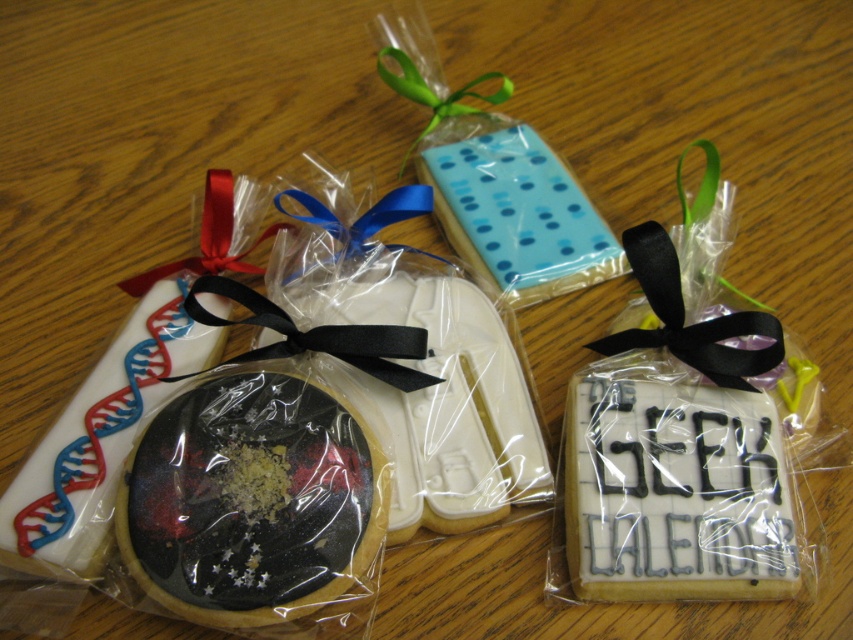
Question: Among these objects, which one is nearest to the camera?

Choices:
 (A) glittery galaxy cookie at center
 (B) red satin ribbon at center

Answer: (A)

Question: Is glittery galaxy cookie at center below red satin ribbon at center?

Choices:
 (A) yes
 (B) no

Answer: (A)

Question: Does glittery galaxy cookie at center come behind red satin ribbon at center?

Choices:
 (A) no
 (B) yes

Answer: (A)

Question: Can you confirm if glittery galaxy cookie at center is positioned above red satin ribbon at center?

Choices:
 (A) no
 (B) yes

Answer: (A)

Question: Among these points, which one is nearest to the camera?

Choices:
 (A) (167, 465)
 (B) (202, 268)

Answer: (A)